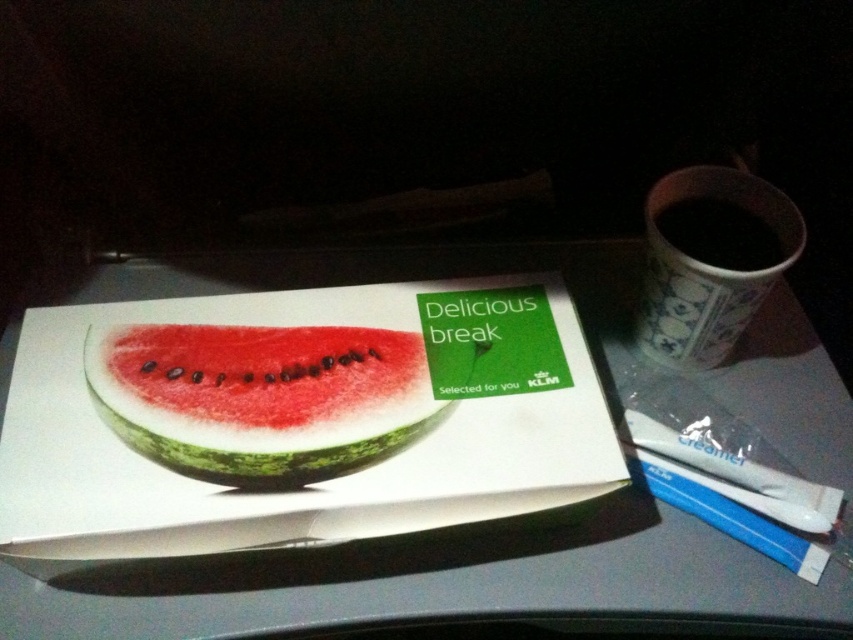
You are a flight attendant checking the items on the tray table. You need to place a new item between the green matte watermelon at center and the black glossy cup at upper right. Where should you place it to ensure it is between them?

The new item should be placed between the green matte watermelon at center and the black glossy cup at upper right, positioned above the green matte watermelon at center and below the black glossy cup at upper right since the watermelon is below the cup.

You are a flight attendant and need to place a new item on the tray table between the black paper cup at upper right and the black glossy cup at upper right. The item is 1.5 inches wide. Will it fit between them?

The black paper cup at upper right and the black glossy cup at upper right are 1.43 inches apart from each other. Since the item is 1.5 inches wide, it will not fit between them as the space is slightly smaller than the item.

You are a passenger on an airplane and want to reach for the item closest to you on the tray table. Which of the two points, point (422, 628) or point (354, 326), is closer to you?

Point (422, 628) is closer to you than point (354, 326).